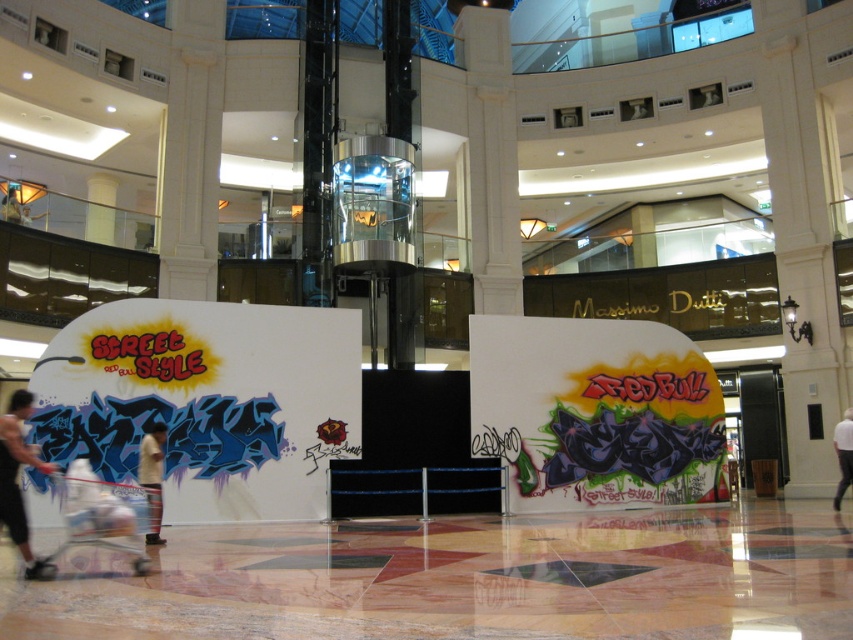
You are a customer trying to decide between two items displayed in a mall store. You see the skinny jeans at lower left and the white fabric at center. Which item is wider?

The skinny jeans at lower left might be wider than white fabric at center.

You are a customer in the mall and want to place a 3 feet wide box between the white plastic baby carriage at lower left and the skinny jeans at lower left. Can you fit the box in the space between them?

The white plastic baby carriage at lower left and the skinny jeans at lower left are 8.50 feet apart. Since the box is 3 feet wide, it can fit in the space between them as the distance is sufficient.